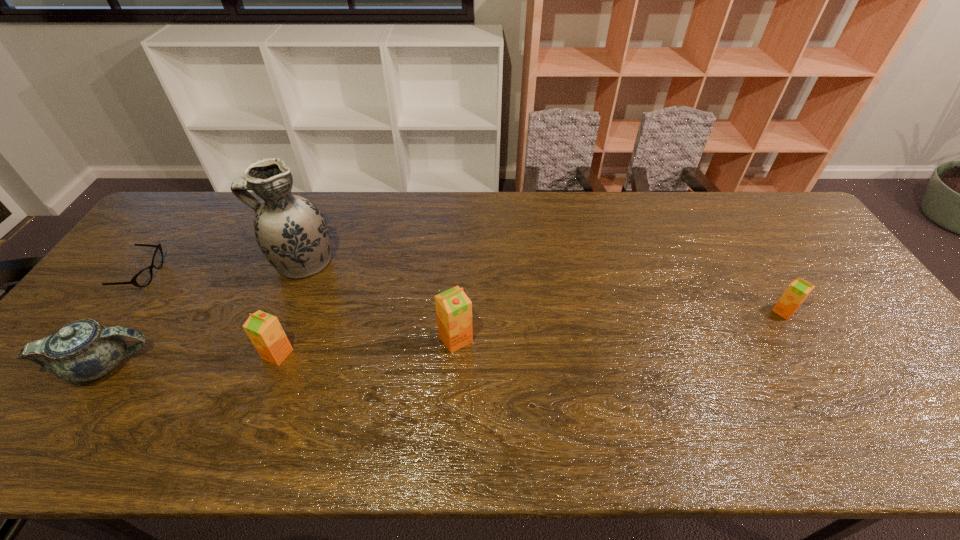
This screenshot has height=540, width=960. In the image, there is a desktop. Find the location of `vacant space at the far edge`. vacant space at the far edge is located at coordinates (573, 233).

In the image, there is a desktop. What are the coordinates of `vacant area at the near edge` in the screenshot? It's located at (554, 386).

In the image, there is a desktop. Identify the location of free space at the right edge. This screenshot has height=540, width=960. (780, 237).

At what (x,y) coordinates should I click in order to perform the action: click on vacant region at the near left corner of the desktop. Please return your answer as a coordinate pair (x, y). This screenshot has height=540, width=960. Looking at the image, I should click on (19, 400).

Where is `vacant area that lies between the leftmost orange juice and the second orange juice from left to right`? This screenshot has height=540, width=960. vacant area that lies between the leftmost orange juice and the second orange juice from left to right is located at coordinates (367, 347).

Where is `free space between the spectacles and the leftmost orange juice`? The width and height of the screenshot is (960, 540). free space between the spectacles and the leftmost orange juice is located at coordinates (211, 314).

I want to click on vacant area that lies between the second shortest orange juice and the second object from right to left, so click(367, 347).

The height and width of the screenshot is (540, 960). What are the coordinates of `free space between the rightmost orange juice and the tallest orange juice` in the screenshot? It's located at (619, 325).

You are a GUI agent. You are given a task and a screenshot of the screen. Output one action in this format:
    pyautogui.click(x=<x>, y=<y>)
    Task: Click on the empty space between the shortest object and the tallest object
    The height and width of the screenshot is (540, 960).
    Given the screenshot: What is the action you would take?
    pyautogui.click(x=223, y=268)

Find the location of `free space between the shortest orange juice and the leftmost orange juice`. free space between the shortest orange juice and the leftmost orange juice is located at coordinates (531, 333).